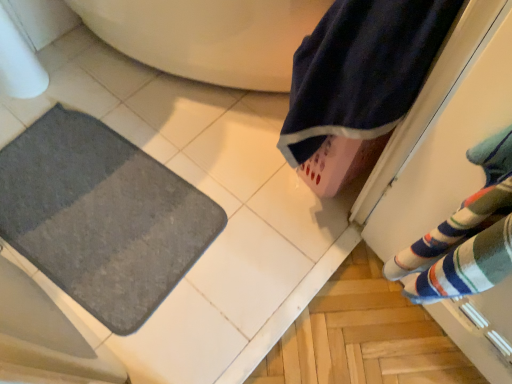
The height and width of the screenshot is (384, 512). What are the coordinates of `vacant area that lies to the right of gray soft mat at lower left` in the screenshot? It's located at (242, 202).